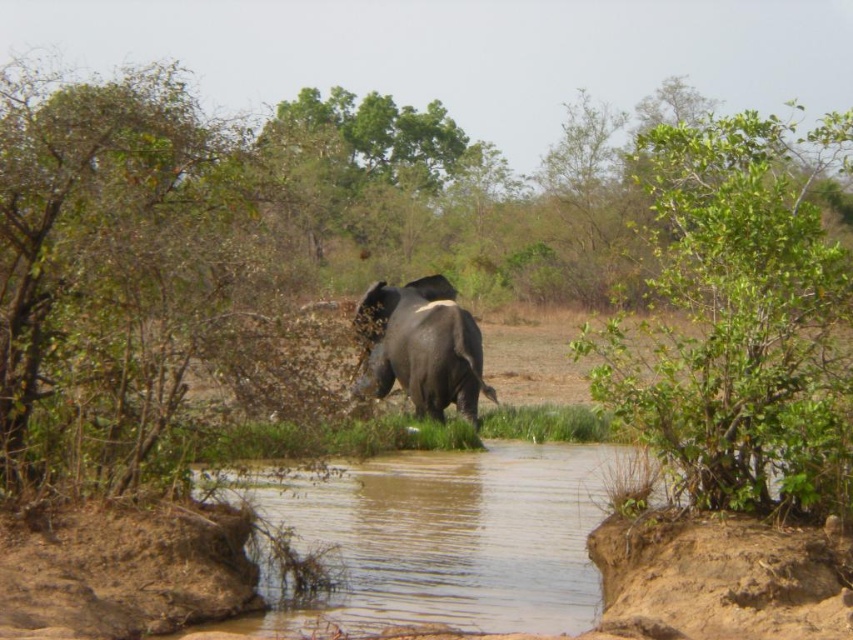
You are a drone operator trying to capture the elephant in the image. The elephant is at the center of the frame. To avoid the brown muddy water at center, where should you adjust your camera angle? Specify the direction as left, right, up, or down.

The brown muddy water at center is located at coordinates point (451,538). To avoid it, adjust the camera angle slightly to the left or up since the water is positioned towards the lower right of the center.

You are a photographer trying to capture the elephant in the scene. You want to focus on the point at point (480,540) and point (428,384). Which point should you adjust your camera focus to first if you want to ensure both points are in focus?

You should focus on point (480,540) first because it is closer to the camera than point (428,384). By focusing on the closer point, the farther point will also be within the depth of field, ensuring both are in focus.

You are a photographer trying to capture the entire scene in one shot. Given that your camera can only focus on objects within a 10m x 10m area, will both the brown muddy water at center and the dark gray elephant at center fit within this frame?

The brown muddy water at center is bigger than the dark gray elephant at center, so both can fit within the 10m x 10m frame as the water is larger but the elephant is central and the area is sufficient to encompass both.